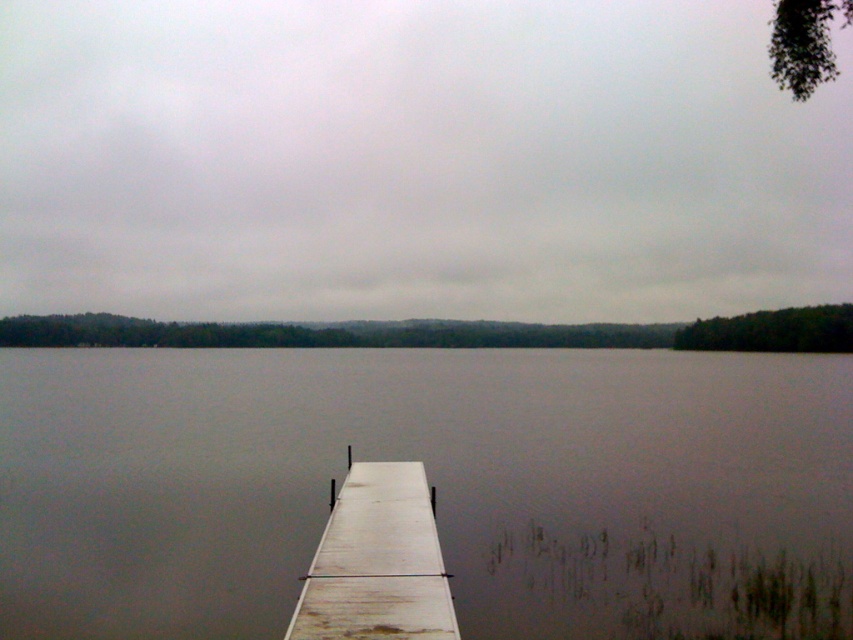
Question: Among these objects, which one is nearest to the camera?

Choices:
 (A) smooth gray water at center
 (B) white wood dock at lower center

Answer: (B)

Question: Is smooth gray water at center below white wood dock at lower center?

Choices:
 (A) no
 (B) yes

Answer: (A)

Question: Does smooth gray water at center appear on the left side of white wood dock at lower center?

Choices:
 (A) no
 (B) yes

Answer: (A)

Question: Observing the image, what is the correct spatial positioning of smooth gray water at center in reference to white wood dock at lower center?

Choices:
 (A) above
 (B) below

Answer: (A)

Question: Among these objects, which one is nearest to the camera?

Choices:
 (A) white wood dock at lower center
 (B) smooth gray water at center

Answer: (A)

Question: Among these objects, which one is farthest from the camera?

Choices:
 (A) smooth gray water at center
 (B) white wood dock at lower center

Answer: (A)